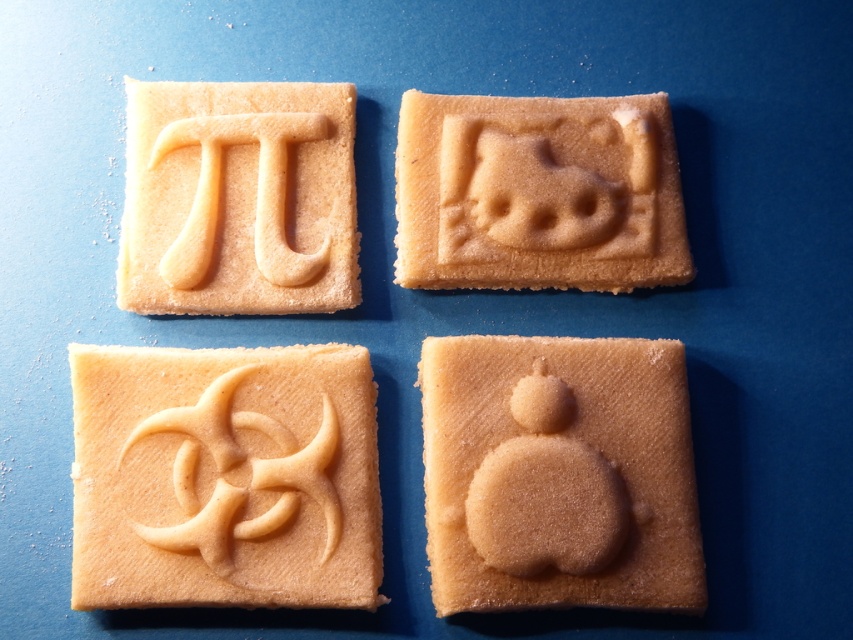
Is matte beige gingerbread at center left thinner than matte beige cookie at upper left?

No.

Is point (215, 403) farther from viewer compared to point (329, 170)?

No, (215, 403) is in front of (329, 170).

Find the location of a particular element. matte beige gingerbread at center left is located at coordinates (224, 477).

Can you confirm if matte brown cookie at bottom right is shorter than matte beige cookie at upper left?

No, matte brown cookie at bottom right is not shorter than matte beige cookie at upper left.

This screenshot has width=853, height=640. In order to click on matte brown cookie at bottom right in this screenshot , I will do `click(558, 474)`.

Is point (498, 403) more distant than point (317, 196)?

No, it is in front of (317, 196).

Image resolution: width=853 pixels, height=640 pixels. In order to click on matte brown cookie at bottom right in this screenshot , I will do `click(558, 474)`.

Which is below, matte yellow gingerbread at upper right or matte beige cookie at upper left?

matte beige cookie at upper left is lower down.

Describe the element at coordinates (537, 193) in the screenshot. The image size is (853, 640). I see `matte yellow gingerbread at upper right` at that location.

Does point (645, 208) come behind point (140, 298)?

Yes, it is.

This screenshot has height=640, width=853. In order to click on matte yellow gingerbread at upper right in this screenshot , I will do `click(537, 193)`.